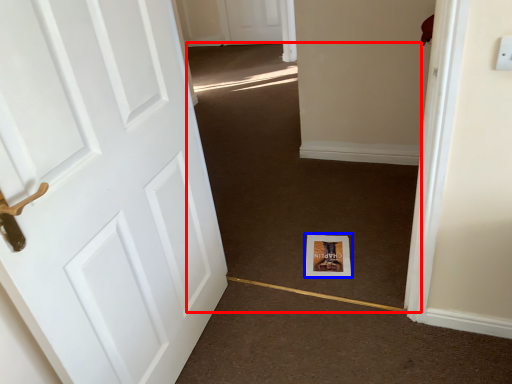
Question: Which of the following is the closest to the observer, plain (highlighted by a red box) or print (highlighted by a blue box)?

Choices:
 (A) plain
 (B) print

Answer: (A)